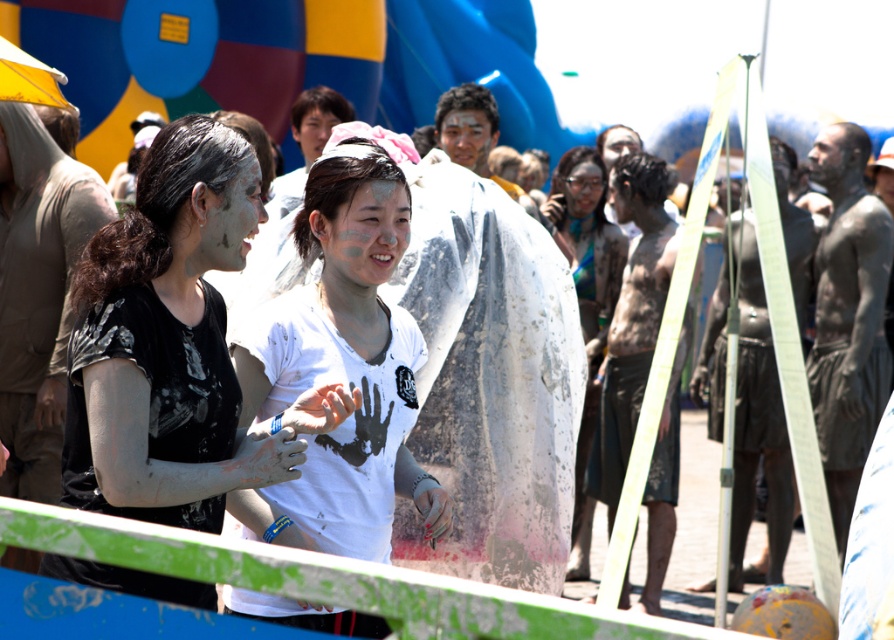
In the scene shown: Between white matte t-shirt at center and matte white dress at center, which one appears on the left side from the viewer's perspective?

From the viewer's perspective, white matte t-shirt at center appears more on the left side.

Is white matte t-shirt at center wider than matte white dress at center?

No, white matte t-shirt at center is not wider than matte white dress at center.

Does point (313, 352) come behind point (580, 262)?

No, (313, 352) is in front of (580, 262).

The width and height of the screenshot is (894, 640). Find the location of `white matte t-shirt at center`. white matte t-shirt at center is located at coordinates (342, 369).

Can you confirm if matte black shirt at center is bigger than white matte t-shirt at center?

Actually, matte black shirt at center might be smaller than white matte t-shirt at center.

Between matte black shirt at center and white matte t-shirt at center, which one is positioned lower?

white matte t-shirt at center is below.

Between point (188, 488) and point (408, 496), which one is positioned in front?

Point (188, 488) is in front.

Locate an element on the screen. This screenshot has height=640, width=894. matte black shirt at center is located at coordinates [x=173, y=346].

Which is below, matte black shirt at center or matte white dress at center?

matte white dress at center

Is point (184, 416) behind point (570, 205)?

No, (184, 416) is in front of (570, 205).

This screenshot has width=894, height=640. Identify the location of matte black shirt at center. (173, 346).